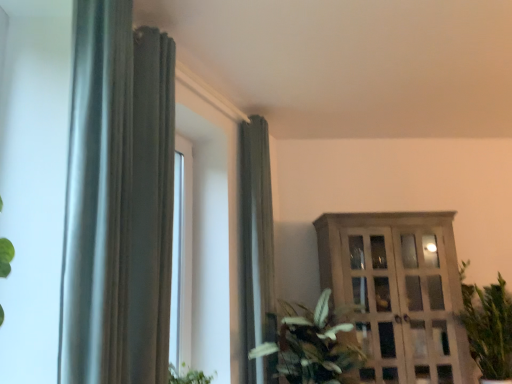
Question: Is wooden cabinet at right smaller than satin silver curtain at left, which is counted as the first curtain, starting from the left?

Choices:
 (A) no
 (B) yes

Answer: (A)

Question: Is wooden cabinet at right to the left of satin silver curtain at left, which ranks as the 2th curtain in back-to-front order, from the viewer's perspective?

Choices:
 (A) no
 (B) yes

Answer: (A)

Question: From a real-world perspective, is wooden cabinet at right beneath satin silver curtain at left, which ranks as the 2th curtain in back-to-front order?

Choices:
 (A) yes
 (B) no

Answer: (A)

Question: Can you confirm if wooden cabinet at right is taller than satin silver curtain at left, which ranks as the 2th curtain in back-to-front order?

Choices:
 (A) no
 (B) yes

Answer: (A)

Question: Is wooden cabinet at right closer to the viewer compared to satin silver curtain at left, which is counted as the first curtain, starting from the left?

Choices:
 (A) yes
 (B) no

Answer: (B)

Question: Does wooden cabinet at right have a larger size compared to satin silver curtain at left, which ranks as the 2th curtain in back-to-front order?

Choices:
 (A) yes
 (B) no

Answer: (A)

Question: Is green leafy plant at center, the 1th houseplant in the left-to-right sequence, taller than green leafy plant at right, marked as the 1th houseplant in a right-to-left arrangement?

Choices:
 (A) yes
 (B) no

Answer: (B)

Question: Is the position of green leafy plant at center, which is counted as the 2th houseplant, starting from the right, more distant than that of green leafy plant at right, marked as the 1th houseplant in a right-to-left arrangement?

Choices:
 (A) no
 (B) yes

Answer: (A)

Question: Is green leafy plant at center, which is counted as the 2th houseplant, starting from the right, positioned before green leafy plant at right, marked as the 1th houseplant in a right-to-left arrangement?

Choices:
 (A) no
 (B) yes

Answer: (B)

Question: From the image's perspective, does green leafy plant at center, which is counted as the 2th houseplant, starting from the right, appear higher than green leafy plant at right, marked as the second houseplant in a left-to-right arrangement?

Choices:
 (A) yes
 (B) no

Answer: (A)

Question: Does green leafy plant at center, which is counted as the 2th houseplant, starting from the right, contain green leafy plant at right, marked as the second houseplant in a left-to-right arrangement?

Choices:
 (A) yes
 (B) no

Answer: (B)

Question: Is green leafy plant at center, which is counted as the 2th houseplant, starting from the right, at the right side of green leafy plant at right, marked as the 1th houseplant in a right-to-left arrangement?

Choices:
 (A) no
 (B) yes

Answer: (A)

Question: Is wooden cabinet at right at the right side of green leafy plant at center, which is counted as the 2th houseplant, starting from the right?

Choices:
 (A) no
 (B) yes

Answer: (B)